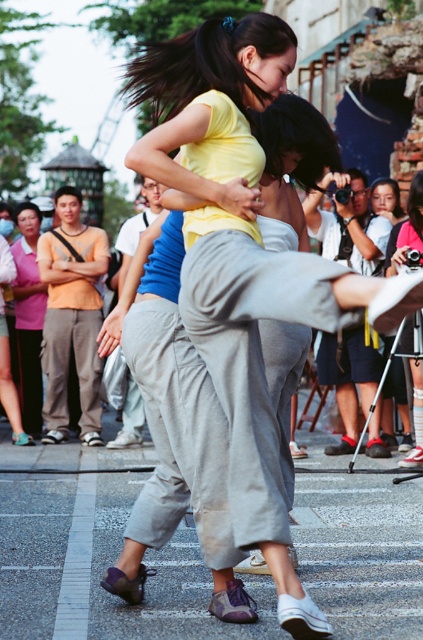
Can you confirm if matte gray pants at center is smaller than matte pink shirt at center?

No.

Locate an element on the screen. Image resolution: width=423 pixels, height=640 pixels. matte gray pants at center is located at coordinates [348, 221].

Describe the element at coordinates (348, 221) in the screenshot. This screenshot has height=640, width=423. I see `matte gray pants at center` at that location.

Identify the location of matte gray pants at center. Image resolution: width=423 pixels, height=640 pixels. (348, 221).

Can you confirm if matte yellow shirt at center is wider than blue cotton shirt at center?

No, matte yellow shirt at center is not wider than blue cotton shirt at center.

Based on the photo, measure the distance between matte yellow shirt at center and camera.

matte yellow shirt at center and camera are 10.70 meters apart.

Find the location of `matte yellow shirt at center`. matte yellow shirt at center is located at coordinates (246, 285).

Between orange cotton shirt at left and pink fabric at lower left, which one appears on the left side from the viewer's perspective?

pink fabric at lower left is more to the left.

The height and width of the screenshot is (640, 423). What are the coordinates of `orange cotton shirt at left` in the screenshot? It's located at (71, 317).

Between point (57, 360) and point (32, 209), which one is positioned in front?

Positioned in front is point (57, 360).

This screenshot has height=640, width=423. In order to click on orange cotton shirt at left in this screenshot , I will do `click(71, 317)`.